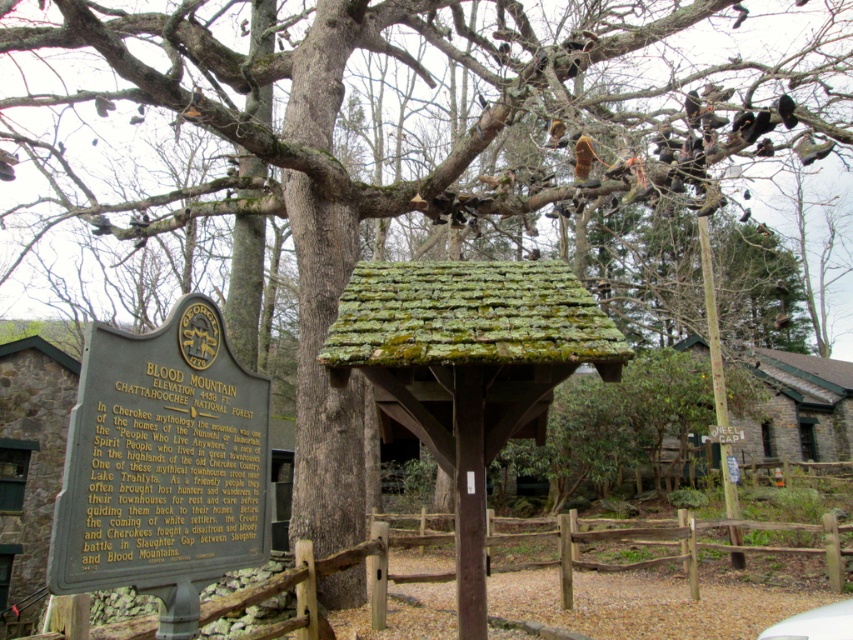
Is green mossy wood hut at lower left smaller than white matte car at lower right?

Incorrect, green mossy wood hut at lower left is not smaller in size than white matte car at lower right.

Which of these two, green mossy wood hut at lower left or white matte car at lower right, stands taller?

green mossy wood hut at lower left is taller.

Between point (32, 628) and point (811, 618), which one is positioned behind?

Positioned behind is point (32, 628).

Locate an element on the screen. The width and height of the screenshot is (853, 640). green mossy wood hut at lower left is located at coordinates (28, 470).

Between green mossy hut at right and white matte car at lower right, which one is positioned lower?

green mossy hut at right

The width and height of the screenshot is (853, 640). Identify the location of green mossy hut at right. (798, 406).

Does green mossy wood hut at lower left have a larger size compared to green mossy hut at right?

Incorrect, green mossy wood hut at lower left is not larger than green mossy hut at right.

From the picture: Which is more to the left, green mossy wood hut at lower left or green mossy hut at right?

Positioned to the left is green mossy wood hut at lower left.

Is point (35, 496) less distant than point (845, 408)?

Yes, it is in front of point (845, 408).

In order to click on green mossy wood hut at lower left in this screenshot , I will do `click(28, 470)`.